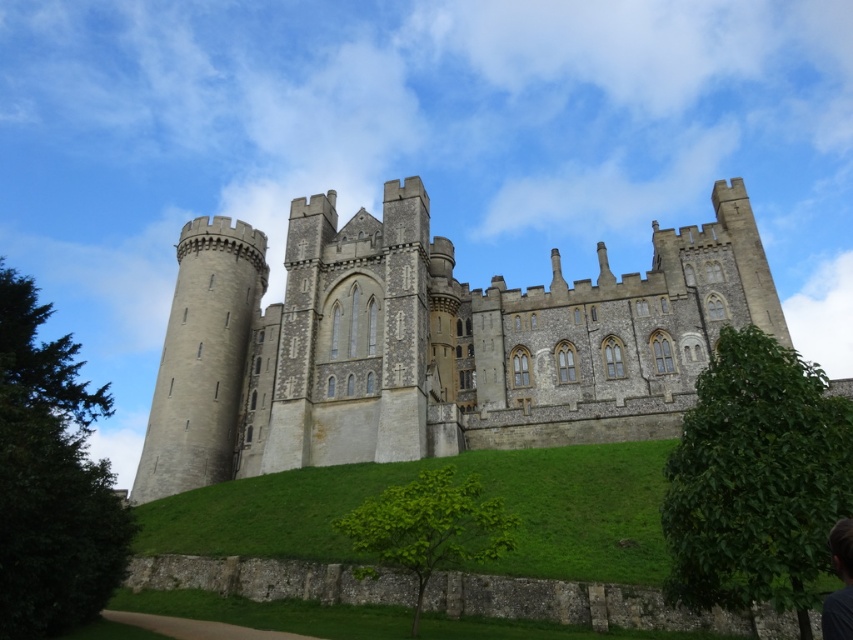
Question: Does gray stone castle at center have a lesser width compared to dark brown hair at lower right?

Choices:
 (A) yes
 (B) no

Answer: (B)

Question: Does gray stone castle at center come in front of dark brown hair at lower right?

Choices:
 (A) yes
 (B) no

Answer: (B)

Question: Which point is closer to the camera?

Choices:
 (A) (831, 545)
 (B) (705, 236)

Answer: (A)

Question: In this image, where is gray stone castle at center located relative to dark brown hair at lower right?

Choices:
 (A) below
 (B) above

Answer: (B)

Question: Which point appears closest to the camera in this image?

Choices:
 (A) (366, 342)
 (B) (843, 570)

Answer: (B)